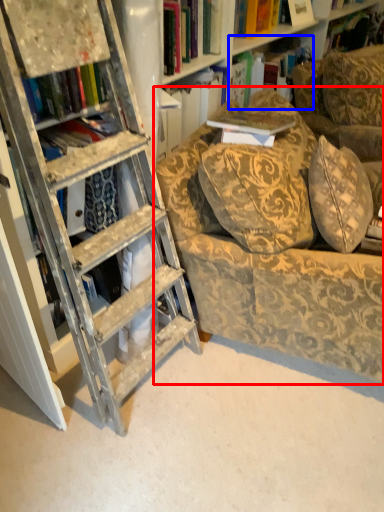
Question: Which object is further to the camera taking this photo, chair (highlighted by a red box) or book (highlighted by a blue box)?

Choices:
 (A) chair
 (B) book

Answer: (B)